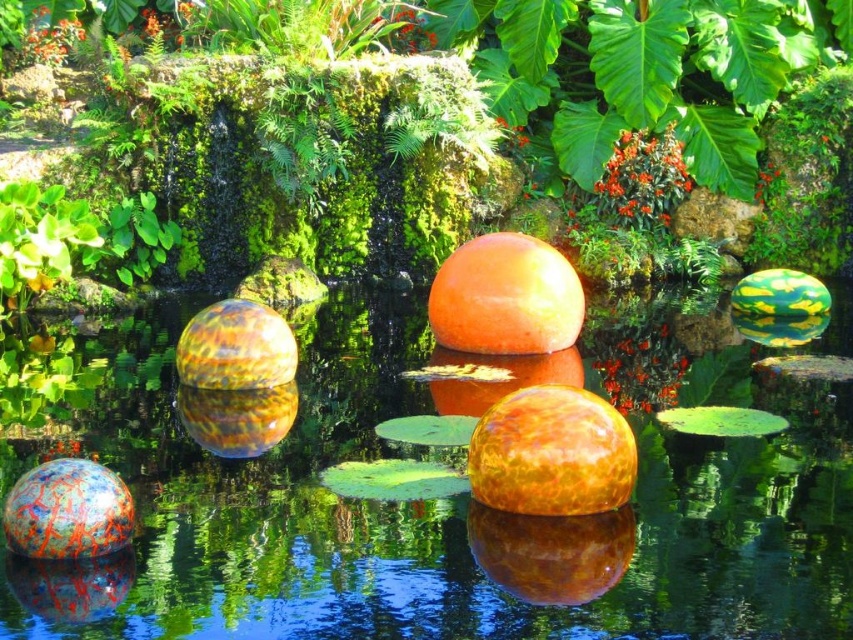
Between translucent orange sphere at center and glossy orange sphere at center, which one appears on the right side from the viewer's perspective?

From the viewer's perspective, glossy orange sphere at center appears more on the right side.

Does translucent orange sphere at center have a larger size compared to glossy orange sphere at center?

No, translucent orange sphere at center is not bigger than glossy orange sphere at center.

Is point (838, 461) farther from viewer compared to point (508, 529)?

Yes, it is.

What are the coordinates of `translucent orange sphere at center` in the screenshot? It's located at (456, 497).

Where is `translucent orange sphere at center`? The image size is (853, 640). translucent orange sphere at center is located at coordinates (456, 497).

Describe the element at coordinates (456, 497) in the screenshot. Image resolution: width=853 pixels, height=640 pixels. I see `translucent orange sphere at center` at that location.

You are a GUI agent. You are given a task and a screenshot of the screen. Output one action in this format:
    pyautogui.click(x=<x>, y=<y>)
    Task: Click on the translucent orange sphere at center
    The image size is (853, 640).
    Given the screenshot: What is the action you would take?
    pyautogui.click(x=456, y=497)

Is point (555, 592) closer to camera compared to point (146, 244)?

Yes, point (555, 592) is closer to viewer.

Locate an element on the screen. This screenshot has height=640, width=853. glossy orange sphere at center is located at coordinates (550, 552).